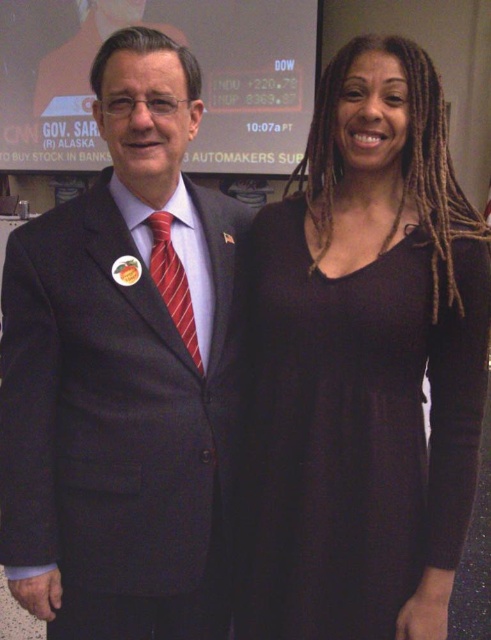
Does dark matte dress at right have a greater width compared to matte black screen at upper center?

No.

Can you confirm if dark matte dress at right is thinner than matte black screen at upper center?

Yes.

The height and width of the screenshot is (640, 491). In order to click on dark matte dress at right in this screenshot , I will do `click(362, 365)`.

Locate an element on the screen. The image size is (491, 640). dark matte dress at right is located at coordinates (362, 365).

Is matte black suit at center further to camera compared to matte black screen at upper center?

No, it is in front of matte black screen at upper center.

Between point (129, 28) and point (73, 140), which one is positioned in front?

Point (129, 28) is more forward.

Between point (99, 401) and point (215, 163), which one is positioned in front?

Point (99, 401)

Find the location of a particular element. matte black suit at center is located at coordinates (124, 372).

In the scene shown: Can you confirm if dark matte dress at right is taller than black hair at right?

Yes, dark matte dress at right is taller than black hair at right.

Who is more distant from viewer, (381,212) or (333,81)?

The point (381,212) is more distant.

Who is more forward, (361, 273) or (430, 166)?

Positioned in front is point (361, 273).

Where is `dark matte dress at right`? dark matte dress at right is located at coordinates (362, 365).